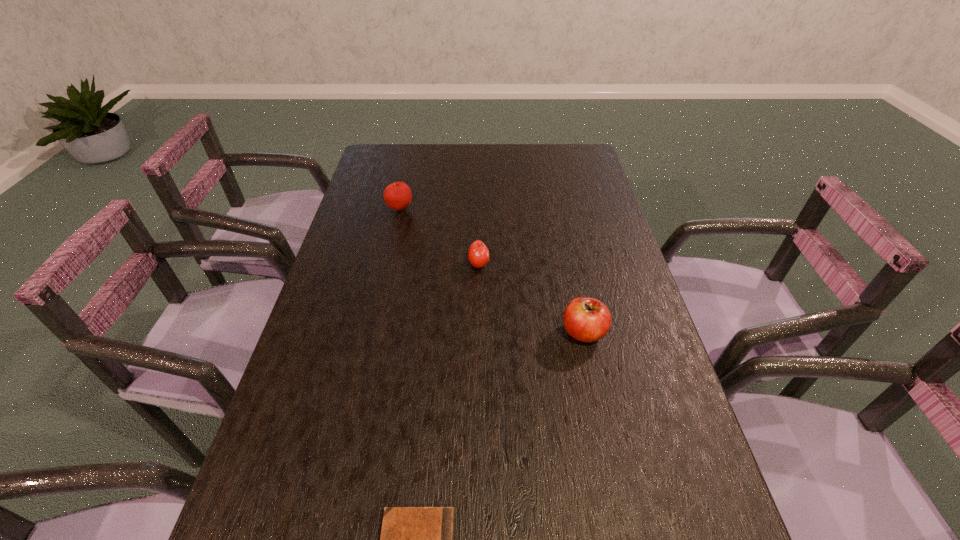
The height and width of the screenshot is (540, 960). I want to click on object that is at the right edge, so click(586, 319).

I want to click on vacant space at the far edge, so click(x=530, y=168).

Where is `free space at the left edge of the desktop`? The width and height of the screenshot is (960, 540). free space at the left edge of the desktop is located at coordinates (271, 432).

Locate an element on the screen. vacant space at the right edge of the desktop is located at coordinates (606, 215).

This screenshot has width=960, height=540. I want to click on free space at the far left corner of the desktop, so click(370, 164).

This screenshot has width=960, height=540. Find the location of `free space at the far right corner of the desktop`. free space at the far right corner of the desktop is located at coordinates (586, 167).

The width and height of the screenshot is (960, 540). I want to click on vacant point located between the third tallest object and the leftmost object, so click(x=439, y=237).

Find the location of a particular element. blank region between the third farthest object and the second farthest apple is located at coordinates (x=531, y=298).

The width and height of the screenshot is (960, 540). Find the location of `empty space between the second shortest object and the third farthest object`. empty space between the second shortest object and the third farthest object is located at coordinates (531, 298).

Find the location of a particular element. The width and height of the screenshot is (960, 540). vacant space in between the farthest object and the nearest apple is located at coordinates (492, 271).